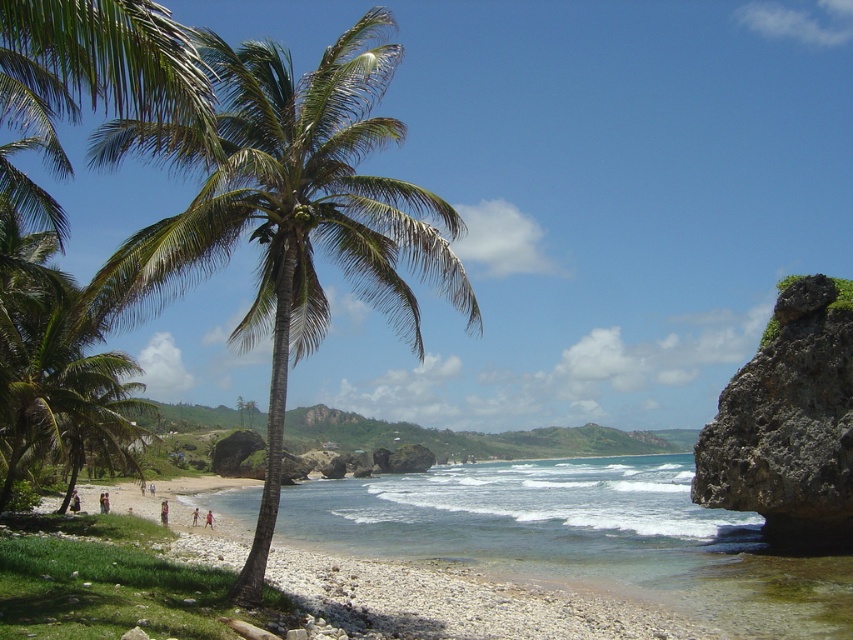
Question: Considering the relative positions of green leafy palm tree at left and white gravel beach at center in the image provided, where is green leafy palm tree at left located with respect to white gravel beach at center?

Choices:
 (A) left
 (B) right

Answer: (B)

Question: Based on their relative distances, which object is nearer to the blurred human figure at center?

Choices:
 (A) white gravel beach at center
 (B) light skin human at center
 (C) tan skin person at center

Answer: (C)

Question: Which point is farther to the camera?

Choices:
 (A) (192, 145)
 (B) (310, 598)
 (C) (166, 499)

Answer: (C)

Question: Is rocky cliff at right below blurred human figure at center?

Choices:
 (A) no
 (B) yes

Answer: (A)

Question: Which of these objects is positioned closest to the rocky cliff at right?

Choices:
 (A) light skin human at center
 (B) blurred human figure at center

Answer: (A)

Question: Can you confirm if green leafy palm tree at left is positioned below white gravel beach at center?

Choices:
 (A) yes
 (B) no

Answer: (B)